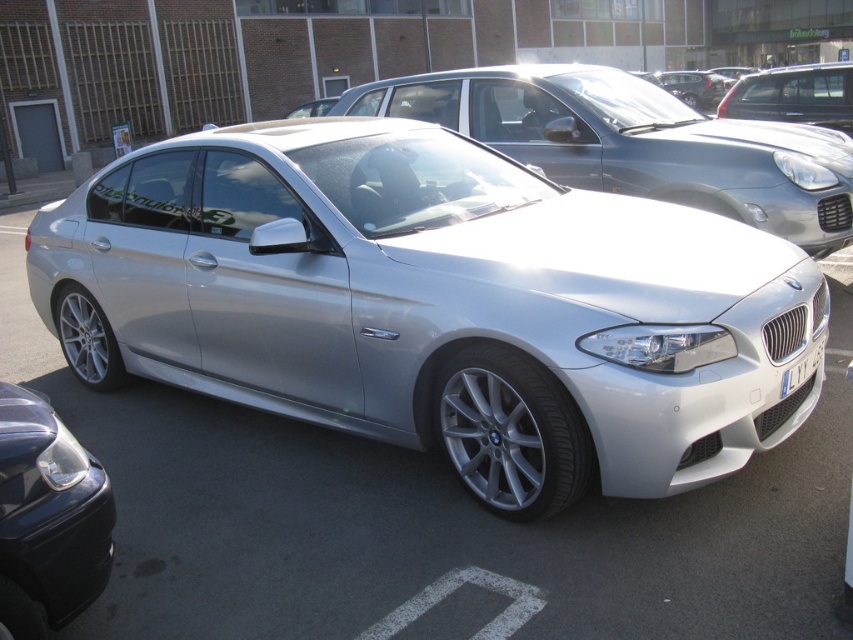
Question: Is silver metallic car at center further to the viewer compared to white metallic license plate at front?

Choices:
 (A) no
 (B) yes

Answer: (B)

Question: Is satin silver car at center thinner than white metallic license plate at front?

Choices:
 (A) no
 (B) yes

Answer: (A)

Question: Which object is closer to the camera taking this photo?

Choices:
 (A) silver metallic car at center
 (B) white metallic license plate at front

Answer: (B)

Question: Which object appears closest to the camera in this image?

Choices:
 (A) black glossy headlight at lower left
 (B) white metallic license plate at front

Answer: (A)

Question: Can you confirm if satin silver car at center is positioned to the right of silver metallic car at center?

Choices:
 (A) yes
 (B) no

Answer: (A)

Question: Which point is farther to the camera?

Choices:
 (A) pos(376,321)
 (B) pos(844,180)
 (C) pos(99,518)

Answer: (B)